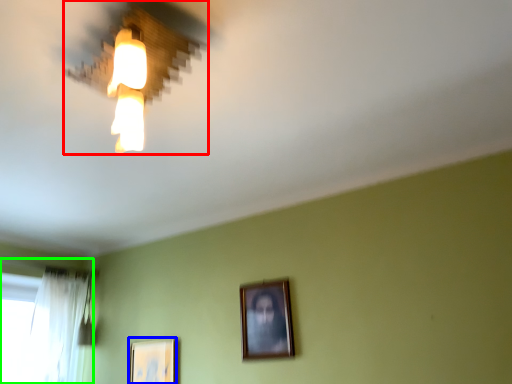
Question: Which object is the farthest from lamp (highlighted by a red box)? Choose among these: picture frame (highlighted by a blue box) or window (highlighted by a green box).

Choices:
 (A) picture frame
 (B) window

Answer: (B)